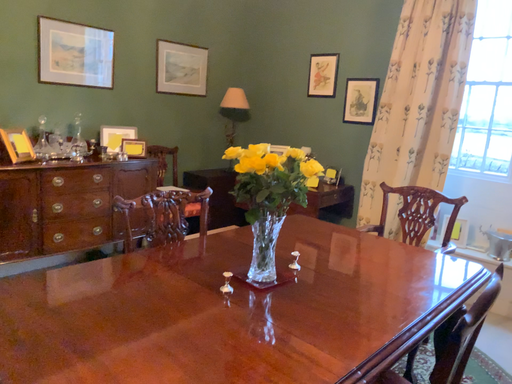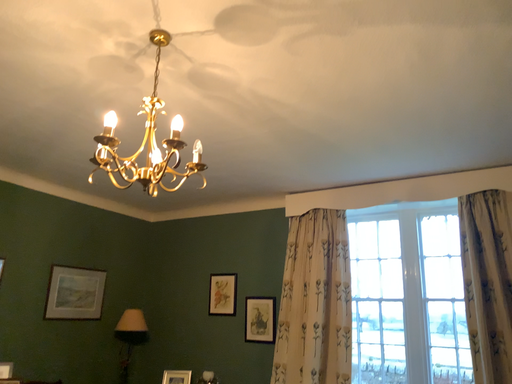
Question: How did the camera likely rotate when shooting the video?

Choices:
 (A) rotated right
 (B) rotated left

Answer: (A)